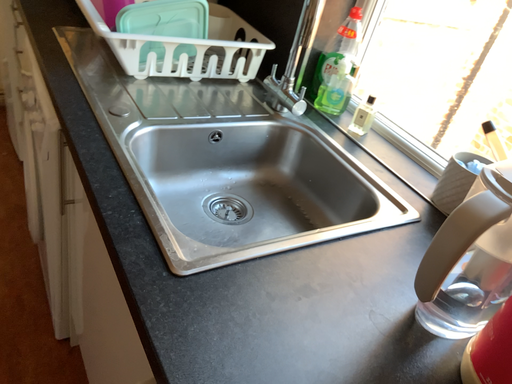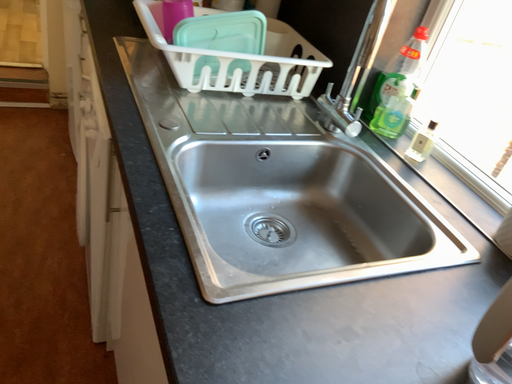
Question: Which way did the camera rotate in the video?

Choices:
 (A) rotated left
 (B) rotated right

Answer: (A)